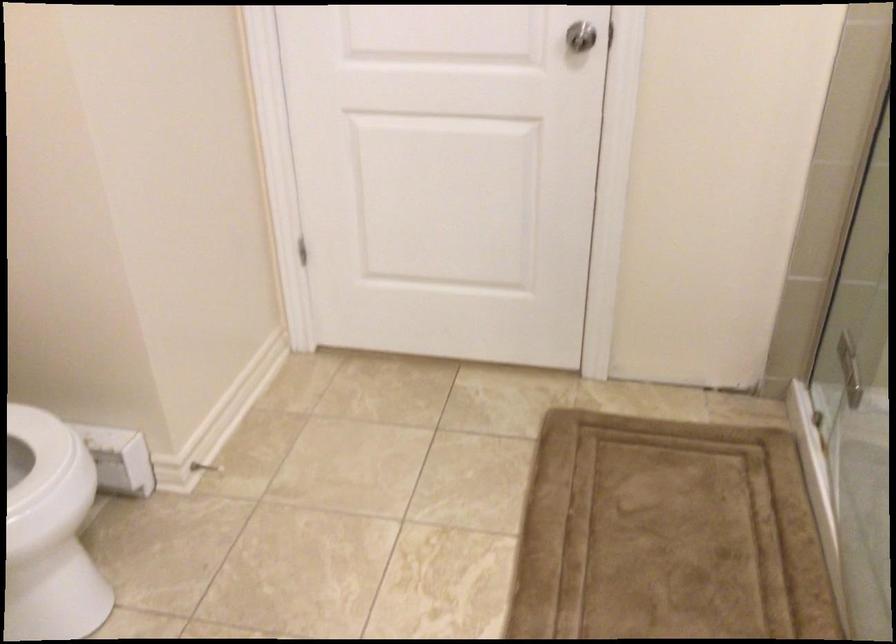
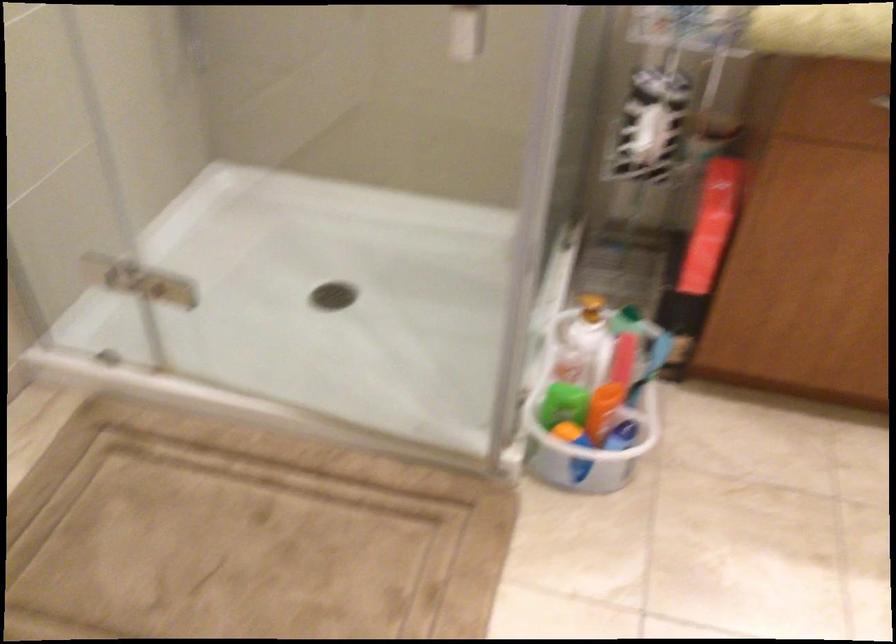
First-person continuous shooting, in which direction is the camera rotating?

The camera rotated toward right-down.